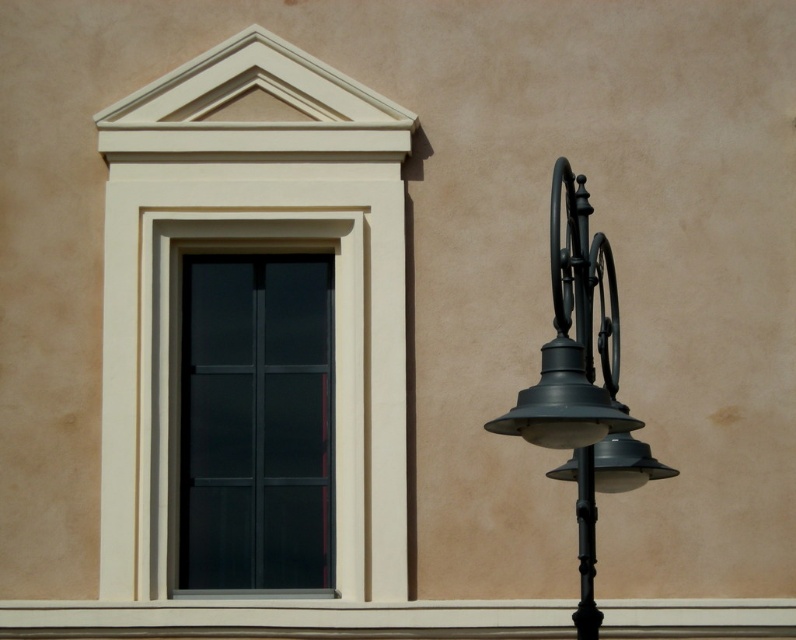
Question: Which point is farther to the camera?

Choices:
 (A) matte black window at center
 (B) matte black street light at right

Answer: (A)

Question: Does matte black window at center have a larger size compared to matte black street light at right?

Choices:
 (A) no
 (B) yes

Answer: (A)

Question: Does matte black window at center have a lesser width compared to matte black street light at right?

Choices:
 (A) yes
 (B) no

Answer: (B)

Question: Is matte black window at center bigger than matte black street light at right?

Choices:
 (A) yes
 (B) no

Answer: (B)

Question: Which of the following is the farthest from the observer?

Choices:
 (A) (634, 445)
 (B) (291, 580)

Answer: (B)